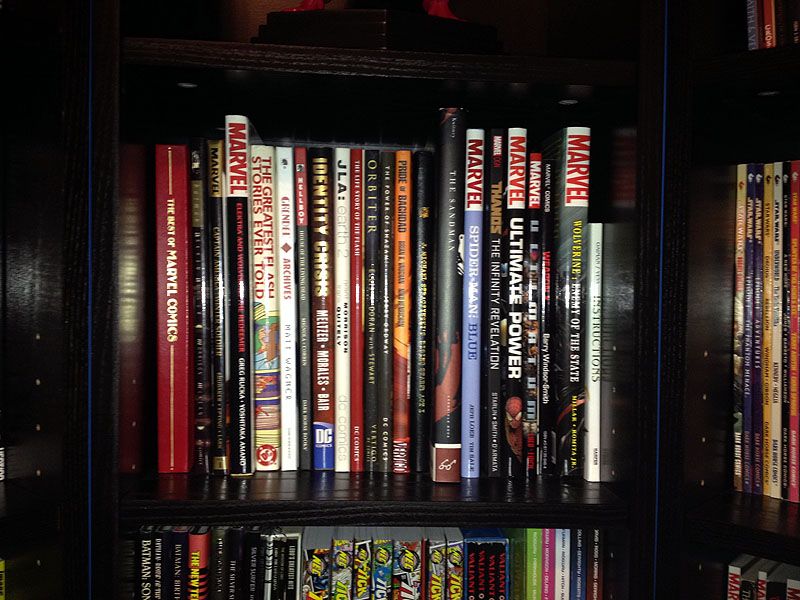
Locate an element on the screen. The height and width of the screenshot is (600, 800). tops of shelves is located at coordinates (342, 481), (777, 508).